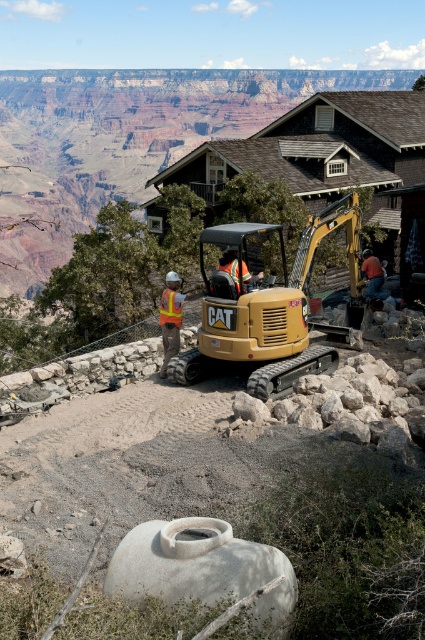
You are a safety inspector at the Grand Canyon construction site. You notice two orange safety vests at the center of the image. Which one is closer to you, the reflective orange vest at center or the orange reflective safety vest at center?

The reflective orange vest at center is closer to you because the orange reflective safety vest at center is behind it.

You are a safety inspector at the Grand Canyon construction site. You need to ensure that the reflective yellow safety vest at center is worn by the worker operating the matte yellow excavator at center. According to safety protocols, the vest must be within 2 meters of the operator seat. Can the inspector confirm compliance?

The distance between the matte yellow excavator at center and the reflective yellow safety vest at center is 2.85 meters, which exceeds the 2 meter requirement. Therefore, the inspector cannot confirm compliance as the vest is too far from the operator seat.